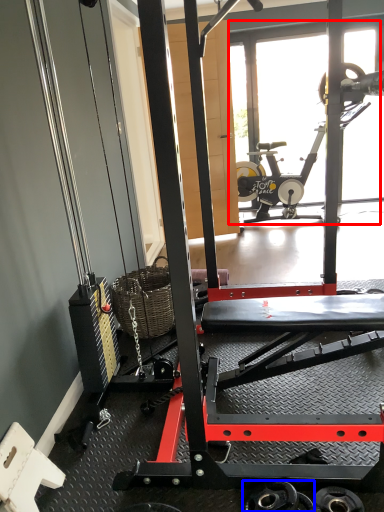
Question: Among these objects, which one is farthest to the camera, glass door (highlighted by a red box) or wheel (highlighted by a blue box)?

Choices:
 (A) glass door
 (B) wheel

Answer: (A)